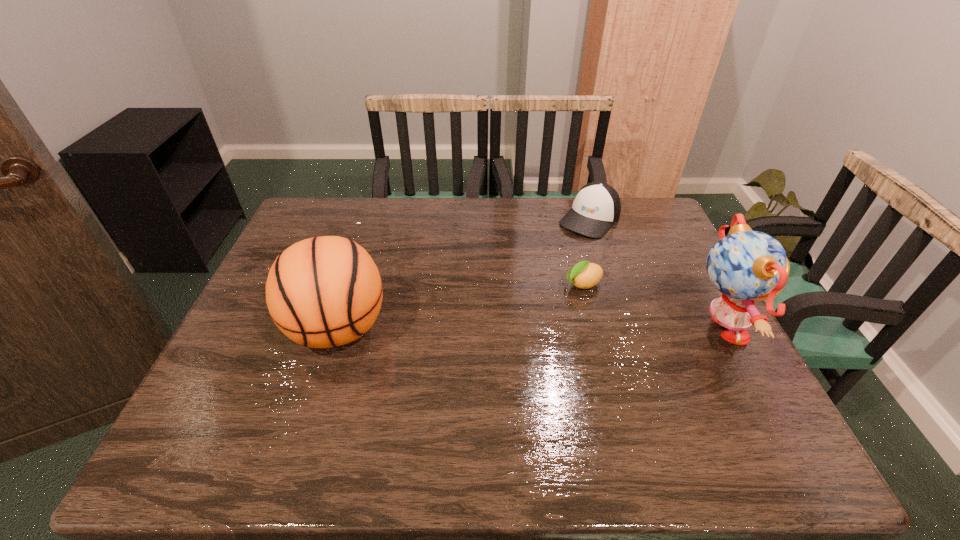
This screenshot has width=960, height=540. I want to click on vacant area that lies between the shortest object and the doll, so (x=649, y=309).

Locate an element on the screen. free space between the leftmost object and the shortest object is located at coordinates [461, 307].

Find the location of a particular element. free space between the basketball and the shortest object is located at coordinates (461, 307).

Identify which object is the third closest to the rightmost object. Please provide its 2D coordinates. Your answer should be formatted as a tuple, i.e. [(x, y)], where the tuple contains the x and y coordinates of a point satisfying the conditions above.

[(322, 292)]

Find the location of `object that stands as the second closest to the farthest object`. object that stands as the second closest to the farthest object is located at coordinates (746, 266).

Locate an element on the screen. free space that satisfies the following two spatial constraints: 1. on the back side of the lemon; 2. on the left side of the farthest object is located at coordinates (566, 219).

You are a GUI agent. You are given a task and a screenshot of the screen. Output one action in this format:
    pyautogui.click(x=<x>, y=<y>)
    Task: Click on the free location that satisfies the following two spatial constraints: 1. on the front side of the second shortest object; 2. on the face of the rightmost object
    
    Given the screenshot: What is the action you would take?
    pyautogui.click(x=626, y=332)